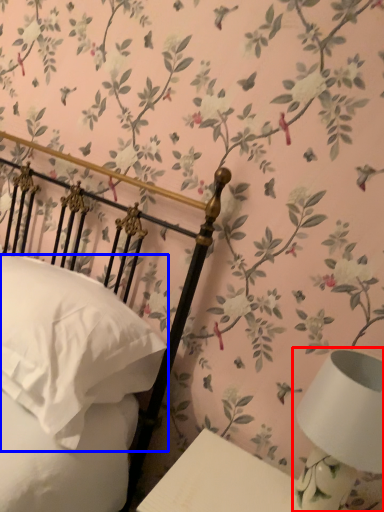
Question: Among these objects, which one is farthest to the camera, table lamp (highlighted by a red box) or pillow (highlighted by a blue box)?

Choices:
 (A) table lamp
 (B) pillow

Answer: (B)